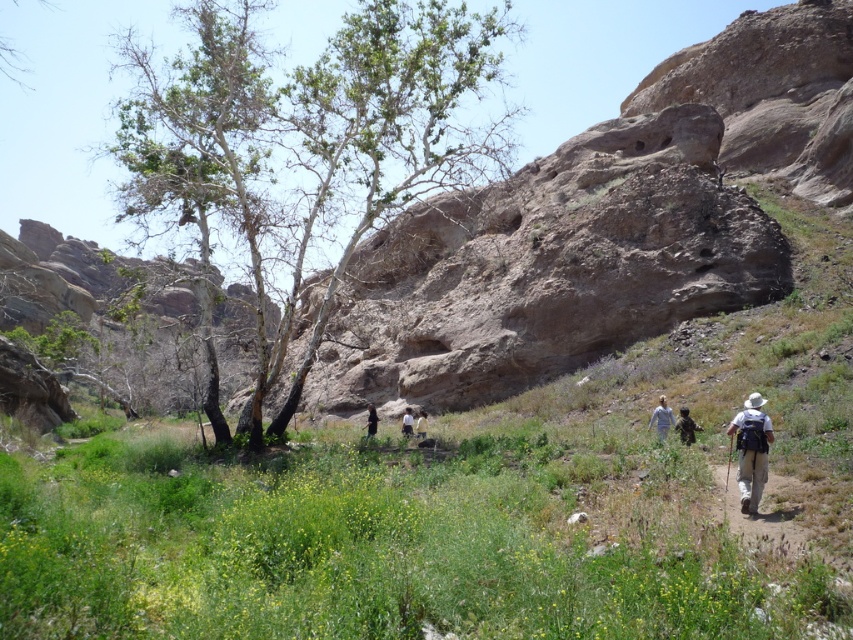
In the scene shown: Is green leafy grass at lower center closer to camera compared to green leafy tree at center?

That is True.

Where is `green leafy grass at lower center`? green leafy grass at lower center is located at coordinates (389, 545).

Identify the location of green leafy grass at lower center. (389, 545).

In the scene shown: Between khaki fabric backpack at lower right and white cotton shirt at lower right, which one has more height?

With more height is khaki fabric backpack at lower right.

Is point (746, 497) positioned after point (682, 428)?

No, it is not.

This screenshot has width=853, height=640. Find the location of `khaki fabric backpack at lower right`. khaki fabric backpack at lower right is located at coordinates (751, 451).

Can you confirm if green leafy tree at center is thinner than white cotton shirt at center?

In fact, green leafy tree at center might be wider than white cotton shirt at center.

Can you confirm if green leafy tree at center is wider than white cotton shirt at center?

Yes, green leafy tree at center is wider than white cotton shirt at center.

The image size is (853, 640). What do you see at coordinates (305, 150) in the screenshot? I see `green leafy tree at center` at bounding box center [305, 150].

Image resolution: width=853 pixels, height=640 pixels. Identify the location of green leafy tree at center. pos(305,150).